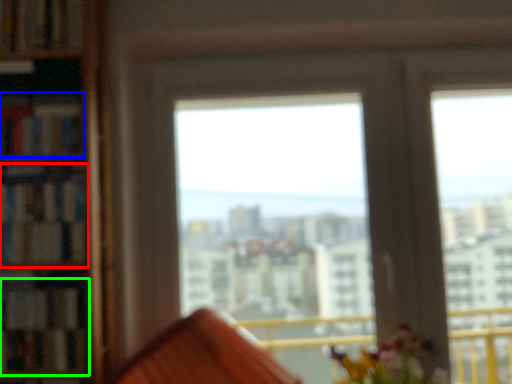
Question: Which object is the farthest from book (highlighted by a red box)? Choose among these: book (highlighted by a blue box) or book (highlighted by a green box).

Choices:
 (A) book
 (B) book

Answer: (B)